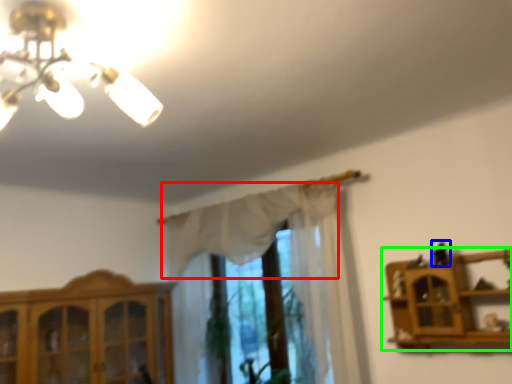
Question: Based on their relative distances, which object is nearer to curtain (highlighted by a red box)? Choose from toy (highlighted by a blue box) and shelf (highlighted by a green box).

Choices:
 (A) toy
 (B) shelf

Answer: (B)